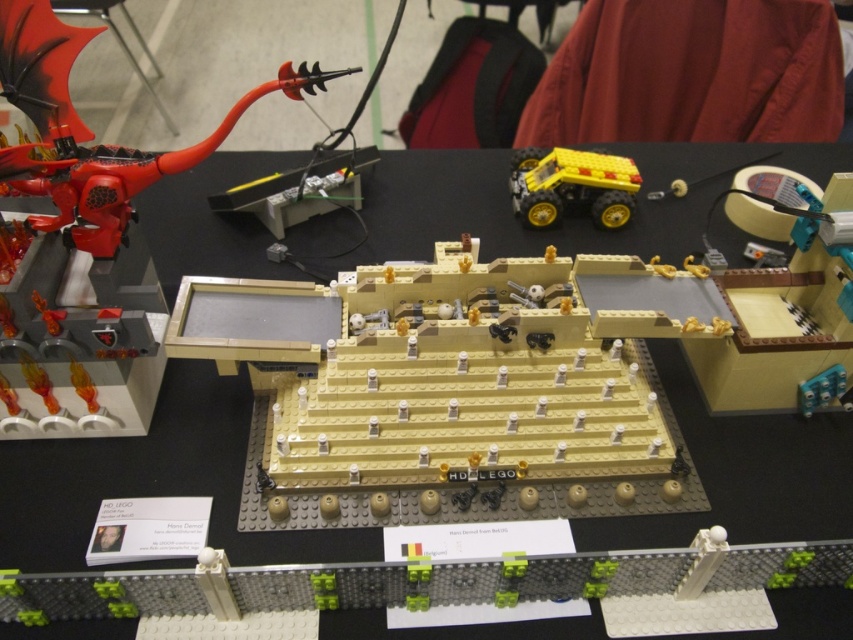
Question: Considering the relative positions of smooth gray wall at lower center and yellow rubber truck at upper right in the image provided, where is smooth gray wall at lower center located with respect to yellow rubber truck at upper right?

Choices:
 (A) right
 (B) left

Answer: (B)

Question: Which object is closer to the camera taking this photo?

Choices:
 (A) yellow rubber truck at upper right
 (B) smooth gray wall at lower center
 (C) beige matte chessboard at center
 (D) shiny red dragon at left

Answer: (B)

Question: Which of the following is the farthest from the observer?

Choices:
 (A) yellow rubber truck at upper right
 (B) shiny red dragon at left
 (C) beige matte chessboard at center

Answer: (A)

Question: Estimate the real-world distances between objects in this image. Which object is farther from the yellow rubber truck at upper right?

Choices:
 (A) beige matte chessboard at center
 (B) shiny red dragon at left
 (C) smooth gray wall at lower center

Answer: (C)

Question: Is beige matte chessboard at center above shiny red dragon at left?

Choices:
 (A) no
 (B) yes

Answer: (A)

Question: Can you confirm if beige matte chessboard at center is positioned above smooth gray wall at lower center?

Choices:
 (A) yes
 (B) no

Answer: (A)